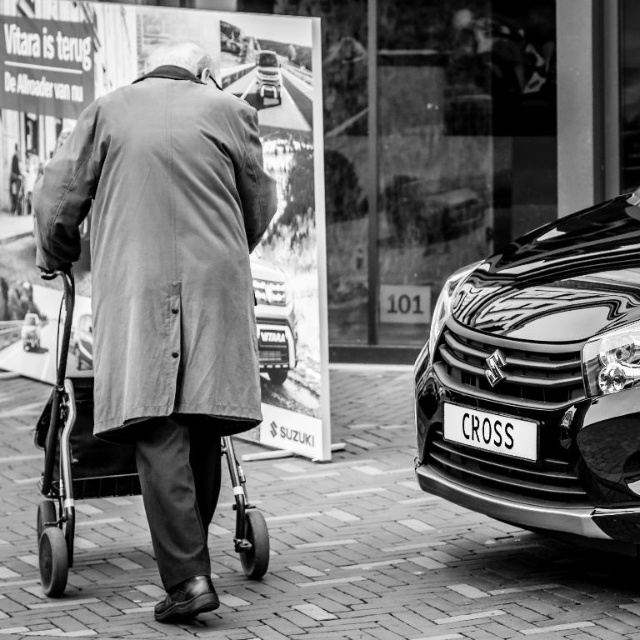
Question: Is the position of black glossy car at right less distant than that of white plastic license plate at lower right?

Choices:
 (A) no
 (B) yes

Answer: (B)

Question: Which point appears closest to the camera in this image?

Choices:
 (A) (616, 280)
 (B) (257, 333)
 (C) (490, 417)

Answer: (A)

Question: Observing the image, what is the correct spatial positioning of matte gray coat at center in reference to white plastic license plate at lower right?

Choices:
 (A) left
 (B) right

Answer: (A)

Question: From the image, what is the correct spatial relationship of black glossy car at right in relation to shiny metallic car at center?

Choices:
 (A) below
 (B) above

Answer: (A)

Question: Which object is the closest to the black glossy car at right?

Choices:
 (A) white plastic license plate at lower right
 (B) shiny metallic car at center

Answer: (A)

Question: Which point is farther to the camera?

Choices:
 (A) (589, 540)
 (B) (280, 346)
 (C) (460, 422)
 (D) (154, 157)

Answer: (B)